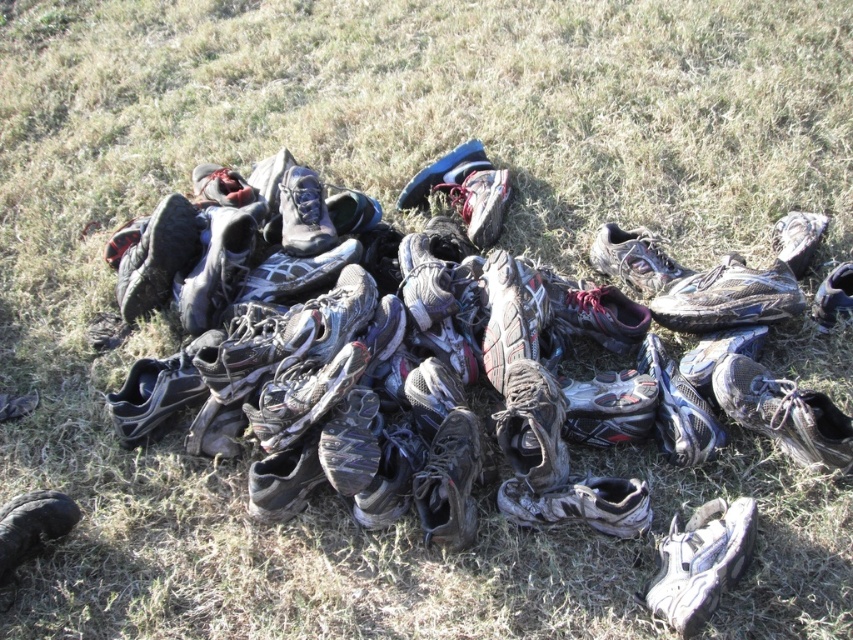
You are standing in the grassy area and want to pick up the shiny black shoe at lower right and the matte gray shoe at upper right. Which shoe should you reach for first to avoid stepping on the other?

You should reach for the shiny black shoe at lower right first because it is closer to you than the matte gray shoe at upper right, so you can pick it up without stepping on the other shoe.

You are a photographer trying to capture the shiny black shoe at lower right and the black leather shoe at lower left. Which shoe is covering part of the other shoe?

The shiny black shoe at lower right is positioned over the black leather shoe at lower left, so it is covering part of it.

You are standing at the origin point of the coordinate system. You want to pick up the shiny black shoe at lower right. What are the coordinates where you should move to?

The coordinates of the shiny black shoe at lower right are at point (784, 413). So you should move to coordinates (784, 413) to pick it up.